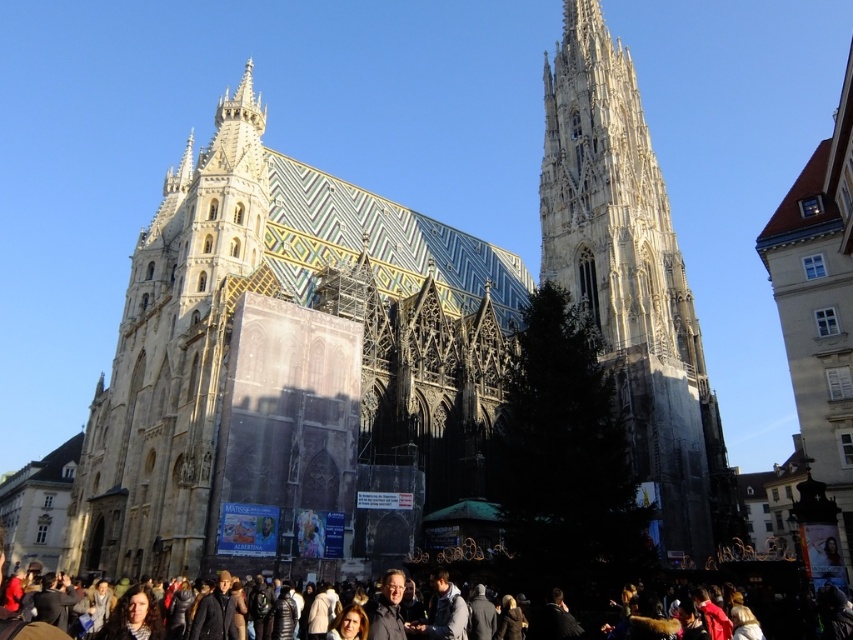
Question: Among these objects, which one is farthest from the camera?

Choices:
 (A) white stone tower at center
 (B) dark gray clothing at center

Answer: (A)

Question: Can you confirm if white stone tower at center is positioned to the left of dark gray clothing at center?

Choices:
 (A) no
 (B) yes

Answer: (A)

Question: Can you confirm if white stone tower at center is positioned to the right of dark gray clothing at center?

Choices:
 (A) no
 (B) yes

Answer: (B)

Question: Which of the following is the closest to the observer?

Choices:
 (A) (15, 630)
 (B) (560, 276)

Answer: (A)

Question: Does white stone tower at center have a greater width compared to dark gray clothing at center?

Choices:
 (A) yes
 (B) no

Answer: (B)